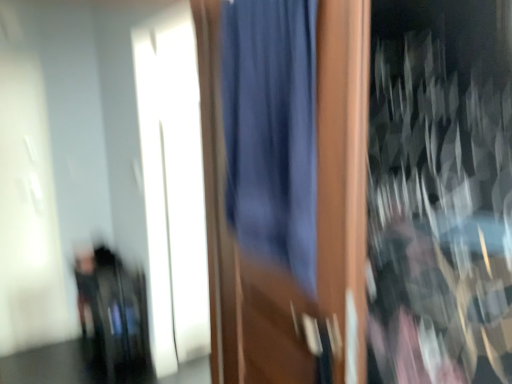
What is the approximate height of blue fabric at center?

It is 5.07 feet.

Locate an element on the screen. blue fabric at center is located at coordinates point(317,217).

The width and height of the screenshot is (512, 384). What do you see at coordinates (317, 217) in the screenshot?
I see `blue fabric at center` at bounding box center [317, 217].

Identify the location of blue fabric at center. [x=317, y=217].